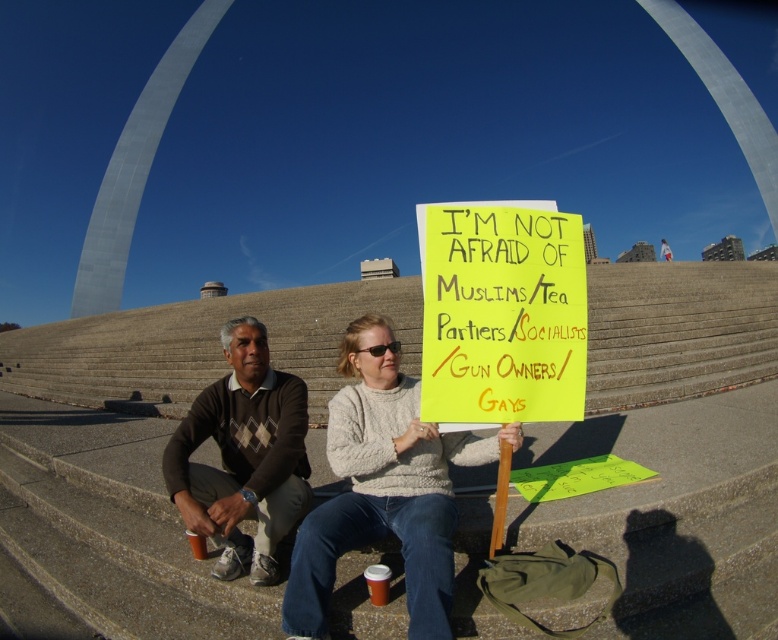
You are an observer standing in front of the two people sitting on the staircase. Which sweater is positioned to the right of the other? The knit sweater at center or the brown argyle sweater at center?

The knit sweater at center is to the right of the brown argyle sweater at center.

You are an interior designer assessing the spatial compatibility of two sweaters displayed at a boutique. The knit sweater at center and the brown argyle sweater at center are both on a mannequin. If the boutique has a display shelf that is 30 inches wide, can both sweaters fit side by side without overlapping?

The knit sweater at center is wider than the brown argyle sweater at center. Since the total width of both sweaters combined would exceed the 30 inch shelf, they cannot fit side by side without overlapping.